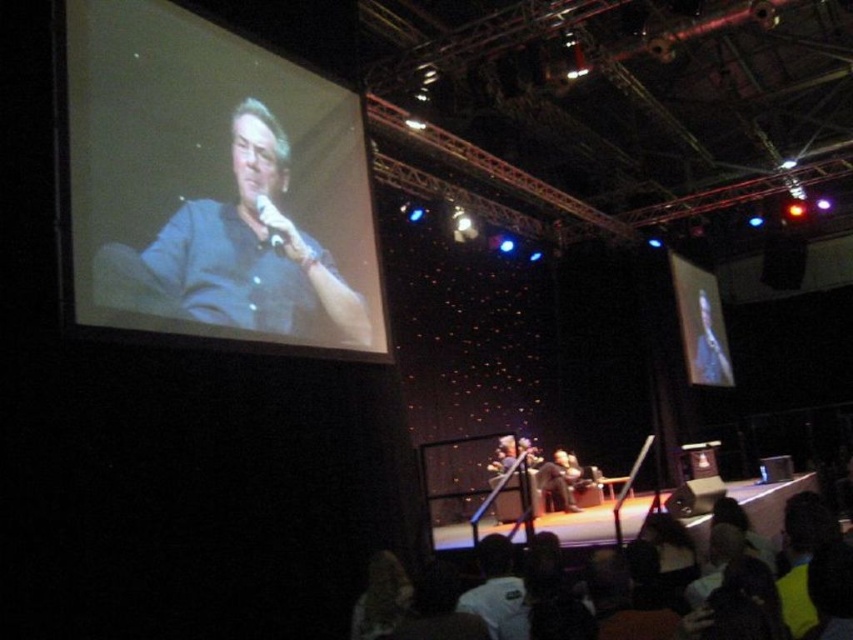
Question: Among these objects, which one is farthest from the camera?

Choices:
 (A) matte black screen at upper left
 (B) matte black microphone at upper left

Answer: (B)

Question: Does matte black screen at upper left appear over matte black microphone at upper left?

Choices:
 (A) yes
 (B) no

Answer: (A)

Question: Among these points, which one is farthest from the camera?

Choices:
 (A) (263, 209)
 (B) (115, 182)

Answer: (A)

Question: Is matte black screen at upper left to the left of matte black microphone at upper left from the viewer's perspective?

Choices:
 (A) yes
 (B) no

Answer: (A)

Question: Is matte black screen at upper left above matte black microphone at upper left?

Choices:
 (A) no
 (B) yes

Answer: (B)